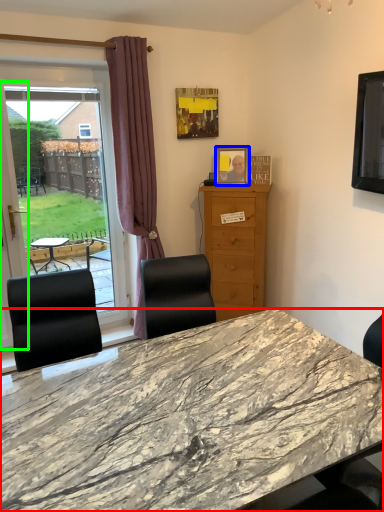
Question: Based on their relative distances, which object is farther from desk (highlighted by a red box)? Choose from picture frame (highlighted by a blue box) and screen door (highlighted by a green box).

Choices:
 (A) picture frame
 (B) screen door

Answer: (A)